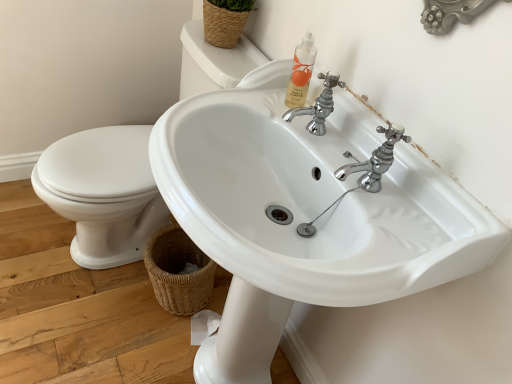
Question: Is point (182, 283) positioned closer to the camera than point (58, 165)?

Choices:
 (A) farther
 (B) closer

Answer: (B)

Question: Would you say brown woven basket at lower left, the 2th basket positioned from the top, is to the left or to the right of white glossy sink at center, arranged as the second sink when viewed from the right, in the picture?

Choices:
 (A) right
 (B) left

Answer: (A)

Question: Estimate the real-world distances between objects in this image. Which object is closer to the white glossy sink at center, positioned as the first sink in right-to-left order?

Choices:
 (A) white glossy sink at center, which ranks as the 1th sink in left-to-right order
 (B) woven straw basket at upper center, the first basket viewed from the top
 (C) brown woven basket at lower left, the 2th basket positioned from the top

Answer: (C)

Question: Which of these objects is positioned farthest from the brown woven basket at lower left, the 2th basket positioned from the top?

Choices:
 (A) woven straw basket at upper center, the 2th basket in the bottom-to-top sequence
 (B) white glossy sink at center, positioned as the first sink in right-to-left order
 (C) white glossy sink at center, which ranks as the 1th sink in left-to-right order

Answer: (A)